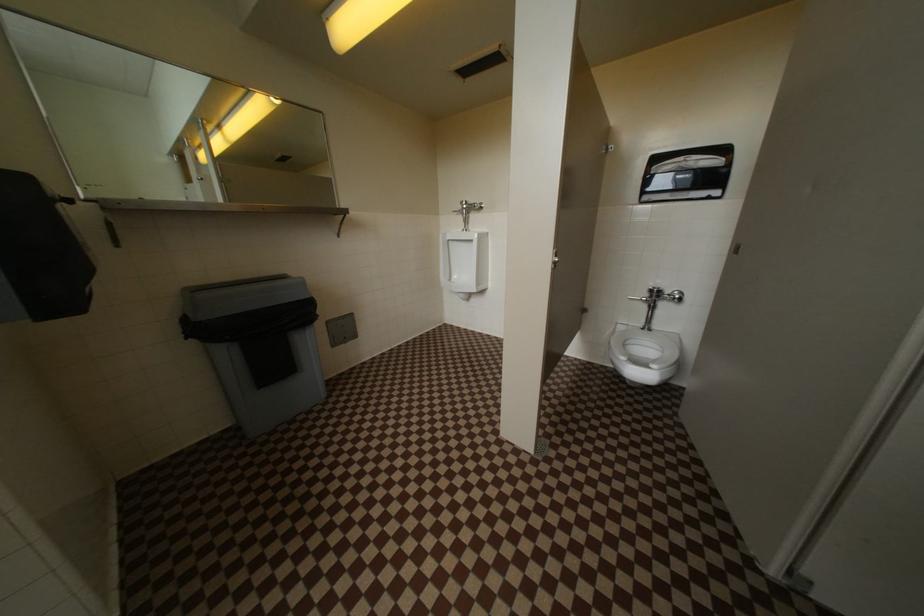
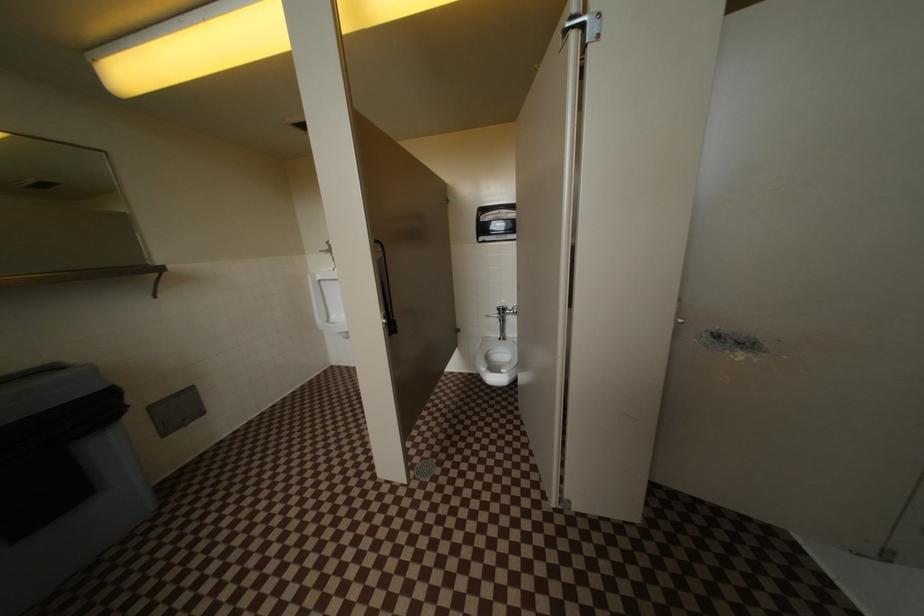
In a continuous first-person perspective shot, in which direction is the camera moving?

The cameraman walked toward right, backward.